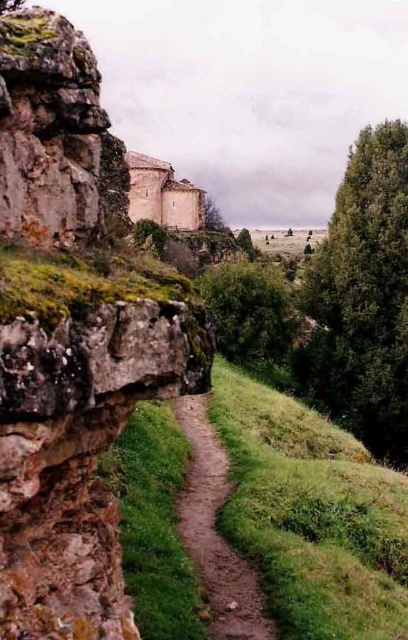
Question: Does brown dirt path at center have a lesser width compared to green leafy tree at center?

Choices:
 (A) yes
 (B) no

Answer: (A)

Question: Can you confirm if green leafy tree at right is positioned above green leafy tree at center?

Choices:
 (A) no
 (B) yes

Answer: (A)

Question: Among these points, which one is farthest from the camera?

Choices:
 (A) (192, 548)
 (B) (270, 337)
 (C) (370, 291)
 (D) (179, 180)

Answer: (D)

Question: Is brown dirt path at center thinner than green leafy tree at center?

Choices:
 (A) no
 (B) yes

Answer: (B)

Question: Which point is farther to the camera?

Choices:
 (A) (361, 332)
 (B) (130, 188)
 (C) (201, 536)

Answer: (B)

Question: Which point is closer to the camera?

Choices:
 (A) (144, 154)
 (B) (268, 628)
 (C) (228, 276)
 (D) (397, 595)

Answer: (B)